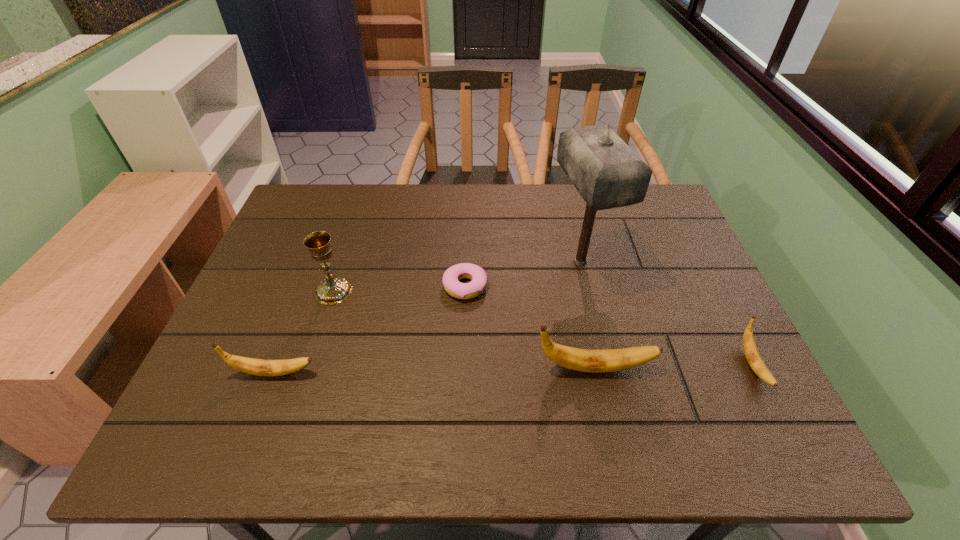
Identify the location of vacant space at the near edge of the desktop. The height and width of the screenshot is (540, 960). (617, 394).

At what (x,y) coordinates should I click in order to perform the action: click on vacant space at the left edge of the desktop. Please return your answer as a coordinate pair (x, y). This screenshot has width=960, height=540. Looking at the image, I should click on (277, 293).

The height and width of the screenshot is (540, 960). What are the coordinates of `vacant space at the right edge of the desktop` in the screenshot? It's located at (658, 272).

Where is `vacant space at the far left corner of the desktop`? This screenshot has height=540, width=960. vacant space at the far left corner of the desktop is located at coordinates (338, 210).

The height and width of the screenshot is (540, 960). In order to click on vacant space at the near left corner in this screenshot , I will do `click(265, 386)`.

Identify the location of vacant space at the far right corner. (666, 213).

This screenshot has width=960, height=540. I want to click on free space at the near right corner of the desktop, so click(727, 399).

The image size is (960, 540). Find the location of `unoccupied position between the mallet and the third shortest object`. unoccupied position between the mallet and the third shortest object is located at coordinates (427, 318).

In order to click on empty space that is in between the fifth shortest object and the second shortest banana in this screenshot , I will do `click(304, 332)`.

At what (x,y) coordinates should I click in order to perform the action: click on free point between the second banana from left to right and the rightmost banana. Please return your answer as a coordinate pair (x, y). The width and height of the screenshot is (960, 540). Looking at the image, I should click on (674, 367).